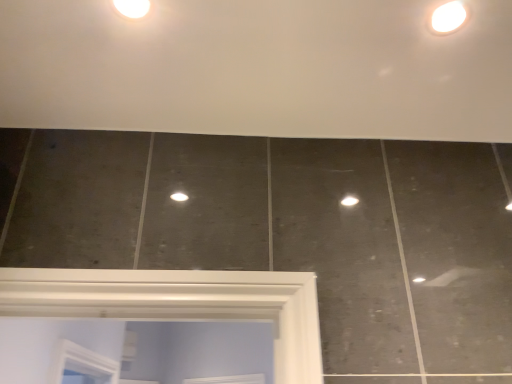
Question: In terms of width, does white glossy light fixture at upper right look wider or thinner when compared to white glossy droplight at upper left?

Choices:
 (A) thin
 (B) wide

Answer: (A)

Question: From the image's perspective, relative to white glossy droplight at upper left, is white glossy light fixture at upper right above or below?

Choices:
 (A) below
 (B) above

Answer: (A)

Question: Would you say white glossy light fixture at upper right is to the left or to the right of white glossy droplight at upper left in the picture?

Choices:
 (A) left
 (B) right

Answer: (B)

Question: Considering the positions of white glossy droplight at upper left and white glossy light fixture at upper right in the image, is white glossy droplight at upper left bigger or smaller than white glossy light fixture at upper right?

Choices:
 (A) big
 (B) small

Answer: (B)

Question: In terms of width, does white glossy droplight at upper left look wider or thinner when compared to white glossy light fixture at upper right?

Choices:
 (A) thin
 (B) wide

Answer: (B)

Question: From the image's perspective, is white glossy droplight at upper left positioned above or below white glossy light fixture at upper right?

Choices:
 (A) below
 (B) above

Answer: (B)

Question: Is white glossy droplight at upper left taller or shorter than white glossy light fixture at upper right?

Choices:
 (A) short
 (B) tall

Answer: (A)